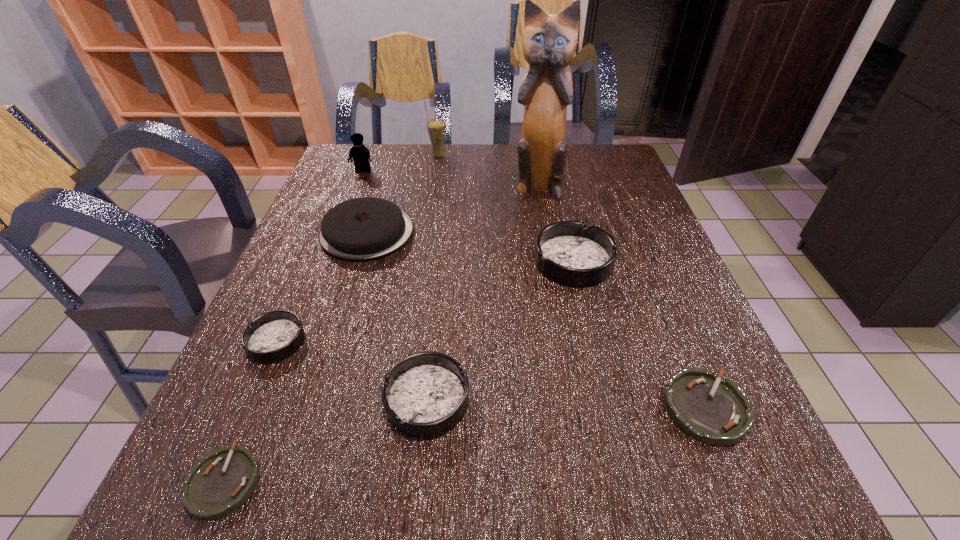
Locate an element on the screen. This screenshot has height=540, width=960. the second nearest dark ashtray is located at coordinates (273, 336).

Where is `the leftmost dark ashtray`? This screenshot has width=960, height=540. the leftmost dark ashtray is located at coordinates (273, 336).

Where is `the right green ashtray`? The height and width of the screenshot is (540, 960). the right green ashtray is located at coordinates (713, 410).

The image size is (960, 540). I want to click on the second shortest object, so click(713, 410).

At what (x,y) coordinates should I click in order to perform the action: click on the shortest object. Please return your answer as a coordinate pair (x, y). Looking at the image, I should click on (220, 482).

The height and width of the screenshot is (540, 960). In order to click on the shortest ashtray in this screenshot , I will do `click(220, 482)`.

Find the location of `vacant space located on the face of the cat`. vacant space located on the face of the cat is located at coordinates (542, 220).

You are a GUI agent. You are given a task and a screenshot of the screen. Output one action in this format:
    pyautogui.click(x=<x>, y=<y>)
    Task: Click on the free space located on the left of the straw for drinking
    This screenshot has width=960, height=540.
    Given the screenshot: What is the action you would take?
    pyautogui.click(x=390, y=156)

Where is `vacant space located on the front-facing side of the third tallest object`? Image resolution: width=960 pixels, height=540 pixels. vacant space located on the front-facing side of the third tallest object is located at coordinates (336, 240).

At what (x,y) coordinates should I click in order to perform the action: click on free spot located on the front of the pancake. Please return your answer as a coordinate pair (x, y). The image size is (960, 540). Looking at the image, I should click on (324, 372).